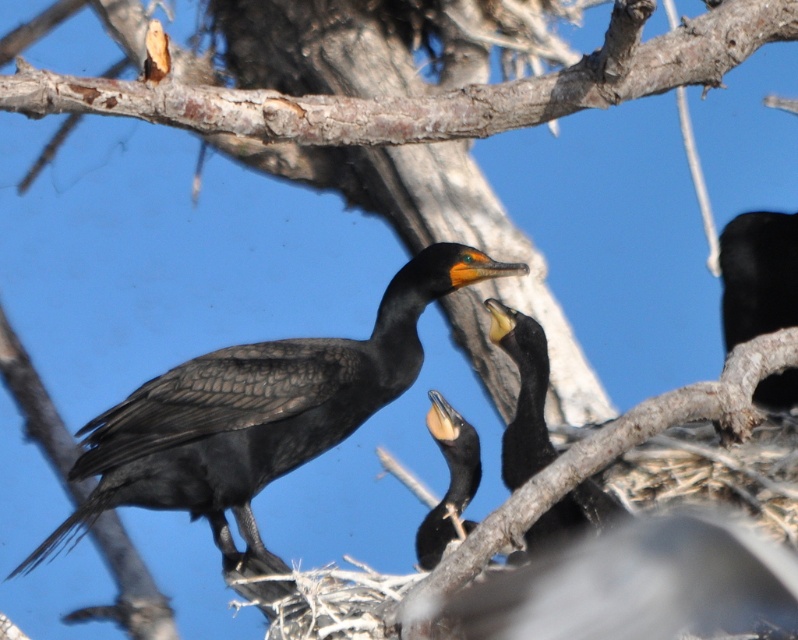
Question: Which of the following is the farthest from the observer?

Choices:
 (A) (725, 307)
 (B) (421, 532)

Answer: (A)

Question: Is smooth bark branch at upper center positioned at the back of shiny black cormorant at center?

Choices:
 (A) no
 (B) yes

Answer: (A)

Question: Which point is closer to the camera taking this photo?

Choices:
 (A) (769, 234)
 (B) (623, 90)

Answer: (B)

Question: Estimate the real-world distances between objects in this image. Which object is farther from the black matte bird at upper right?

Choices:
 (A) matte black bird at center
 (B) shiny black cormorant at center

Answer: (A)

Question: Is black matte bird at center above black matte bird at upper right?

Choices:
 (A) no
 (B) yes

Answer: (A)

Question: Where is matte black bird at center located in relation to black matte bird at upper right in the image?

Choices:
 (A) left
 (B) right

Answer: (A)